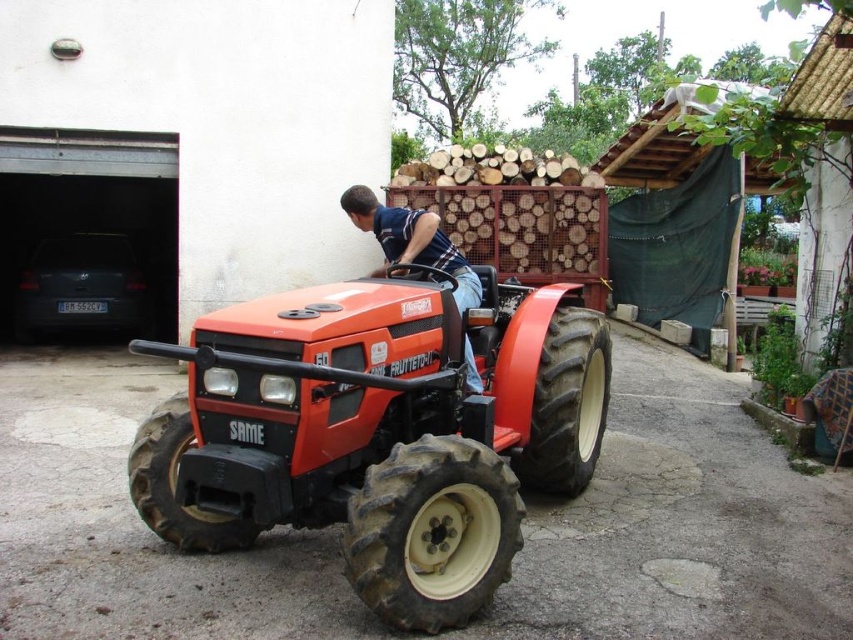
Based on the photo, you are a farmer who needs to check the height of the matte orange tractor at center to ensure it can pass under a low bridge. You also notice the blue striped shirt at center. Which object is taller?

The matte orange tractor at center is taller than the blue striped shirt at center, so the tractor may not fit under the low bridge.

Looking at this image, you are standing in the driveway and want to move from the blue striped shirt at center to the matte orange tractor at center. Which direction should you move in?

The matte orange tractor at center is to the right of the blue striped shirt at center, so you should move to the right to reach it.